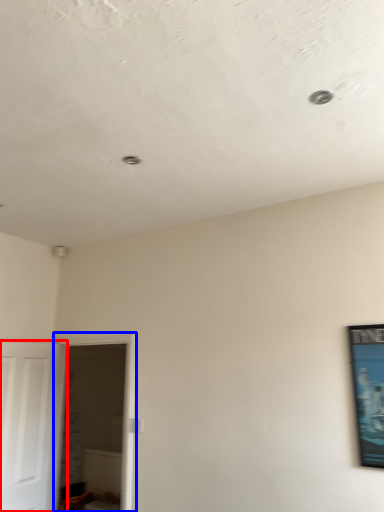
Question: Which of the following is the closest to the observer, door (highlighted by a red box) or glass door (highlighted by a blue box)?

Choices:
 (A) door
 (B) glass door

Answer: (A)